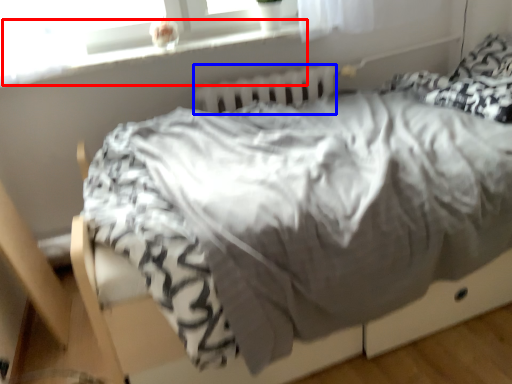
Question: Which point is further to the camera, window sill (highlighted by a red box) or radiator (highlighted by a blue box)?

Choices:
 (A) window sill
 (B) radiator

Answer: (B)